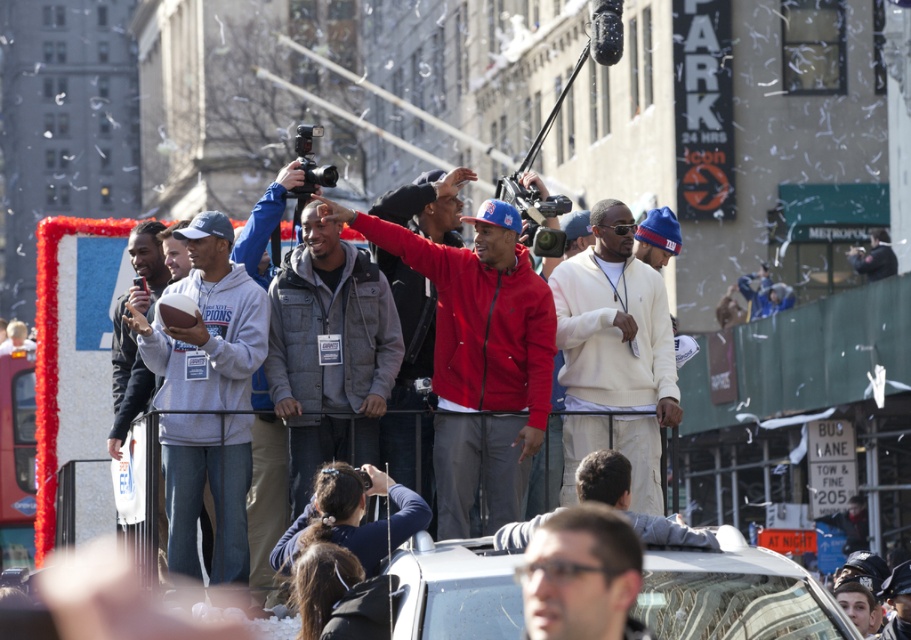
Between red matte jacket at center and light beige sweater at center, which one appears on the right side from the viewer's perspective?

light beige sweater at center is more to the right.

At what (x,y) coordinates should I click in order to perform the action: click on red matte jacket at center. Please return your answer as a coordinate pair (x, y). Looking at the image, I should click on 479,356.

Does gray puffy jacket at center appear over gray fleece sweatshirt at left?

Yes.

Which is in front, point (290, 298) or point (114, 326)?

Point (290, 298)

Who is more forward, (297, 259) or (126, 392)?

Point (297, 259) is in front.

At what (x,y) coordinates should I click in order to perform the action: click on gray puffy jacket at center. Please return your answer as a coordinate pair (x, y). This screenshot has width=911, height=640. Looking at the image, I should click on (329, 349).

Between gray fleece sweatshirt at center and gray fleece sweatshirt at left, which one has less height?

gray fleece sweatshirt at center is shorter.

Does gray fleece sweatshirt at center appear under gray fleece sweatshirt at left?

Indeed, gray fleece sweatshirt at center is positioned under gray fleece sweatshirt at left.

Is point (193, 474) positioned before point (147, 486)?

No, (193, 474) is behind (147, 486).

The image size is (911, 640). Find the location of `gray fleece sweatshirt at center`. gray fleece sweatshirt at center is located at coordinates (208, 326).